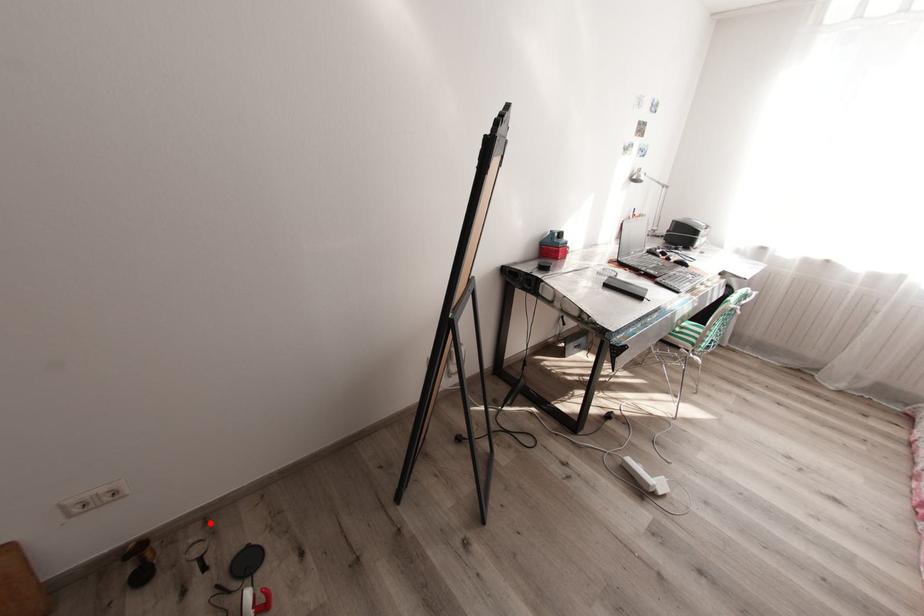
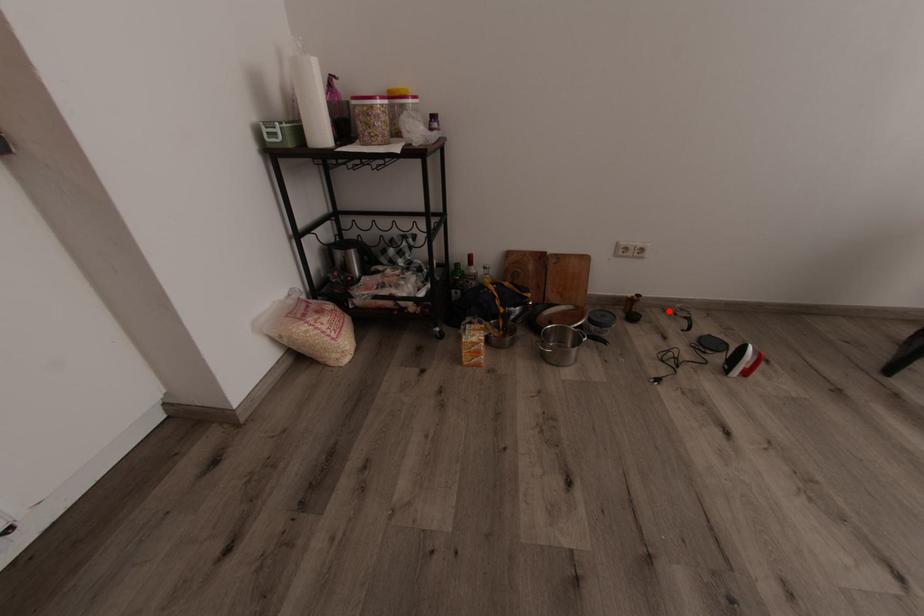
I am providing you with two images of the same scene from different viewpoints. A red point is marked on the first image and another point is marked on the second image. Is the marked point in image1 the same physical position as the marked point in image2?

Yes